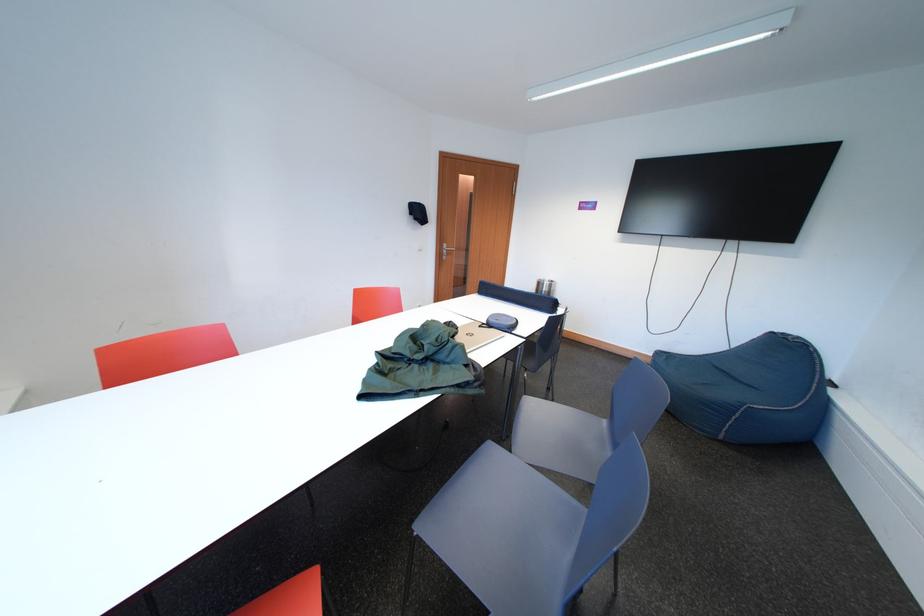
What do you see at coordinates (708, 377) in the screenshot?
I see `a sofa sitting surface` at bounding box center [708, 377].